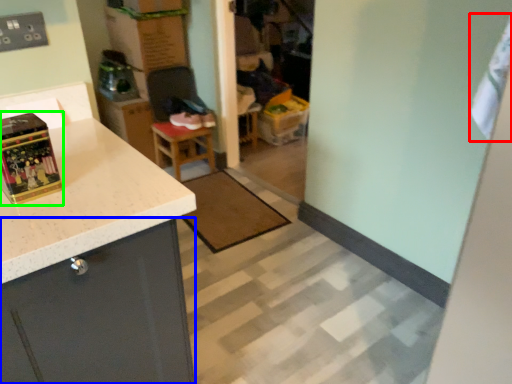
Question: Based on their relative distances, which object is nearer to laundry (highlighted by a red box)? Choose from cabinetry (highlighted by a blue box) and box (highlighted by a green box).

Choices:
 (A) cabinetry
 (B) box

Answer: (A)